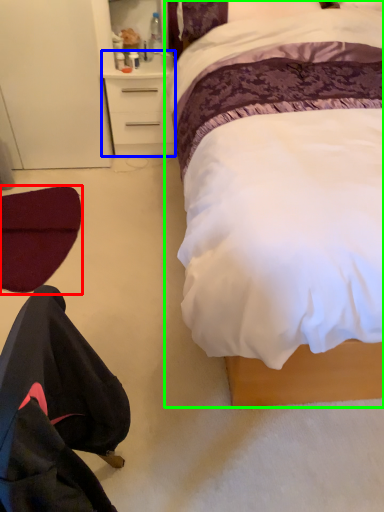
Question: Which is farther away from swivel chair (highlighted by a red box)? desk (highlighted by a blue box) or bed (highlighted by a green box)?

Choices:
 (A) desk
 (B) bed

Answer: (B)